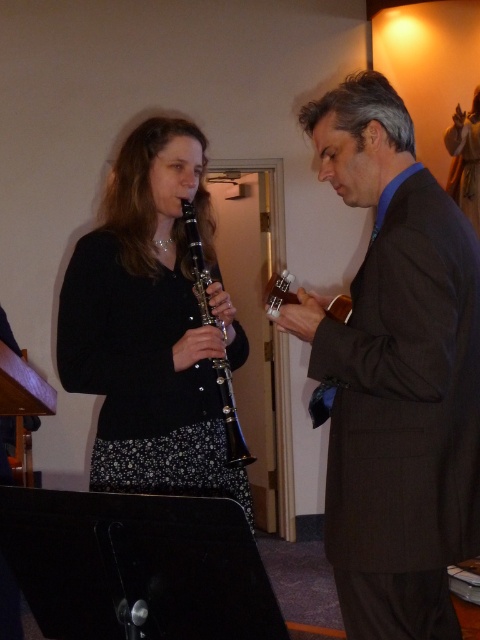
You are a photographer setting up for a photo shoot in the room. You want to position a spotlight so it illuminates both the brown wool suit at right and the black matte clarinet at center without casting shadows over the music stand in the foreground. Considering their positions, which object should you place the spotlight closer to?

The brown wool suit at right is in front of the black matte clarinet at center, so to avoid casting shadows on the music stand, the spotlight should be placed closer to the brown wool suit at right.

You are a photographer standing in the room. You want to take a photo of the brown wool suit at right and the black matte clarinet at center so that both are in focus. The camera you are using has a depth of field that can cover 18 inches. Can you capture both objects in focus without adjusting your camera settings?

The brown wool suit at right and black matte clarinet at center are 17.81 inches apart. Since the distance between them is within the camera depth of field of 18 inches, you can capture both objects in focus without adjusting your camera settings.